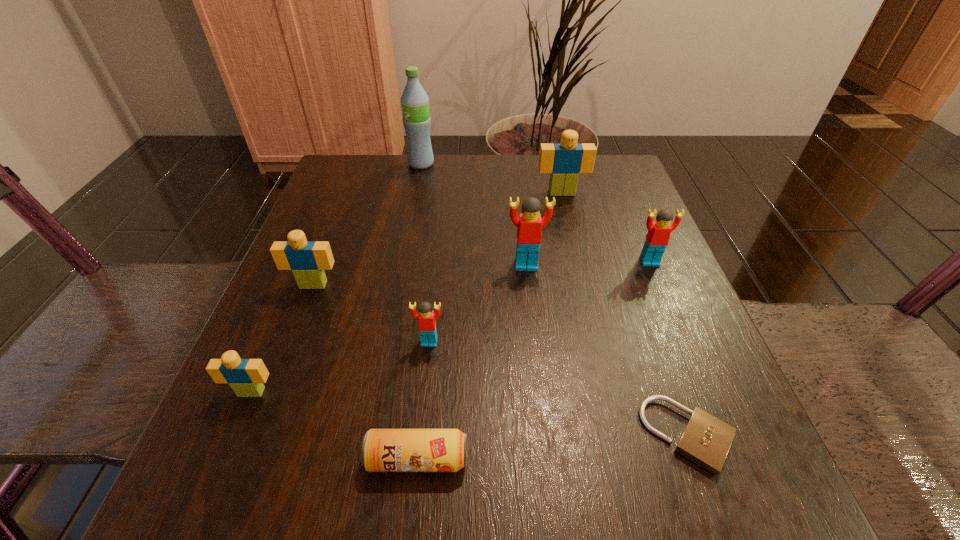
Where is `the second nearest Lego`? the second nearest Lego is located at coordinates (426, 319).

I want to click on the nearest red Lego, so click(426, 319).

Identify the location of the nearest Lego. This screenshot has height=540, width=960. (246, 377).

You are a GUI agent. You are given a task and a screenshot of the screen. Output one action in this format:
    pyautogui.click(x=<x>, y=<y>)
    Task: Click on the smallest beige Lego
    The width and height of the screenshot is (960, 540).
    Given the screenshot: What is the action you would take?
    pyautogui.click(x=246, y=377)

This screenshot has width=960, height=540. I want to click on beer can, so click(x=383, y=450).

This screenshot has height=540, width=960. In order to click on beige padlock in this screenshot , I will do `click(706, 440)`.

Locate an element on the screen. padlock is located at coordinates (706, 440).

I want to click on vacant area situated on the left of the green water bottle, so click(x=376, y=164).

Identify the location of vacant space located 0.070m on the face of the fifth Lego from left to right. This screenshot has height=540, width=960. (567, 215).

You are a GUI agent. You are given a task and a screenshot of the screen. Output one action in this format:
    pyautogui.click(x=<x>, y=<y>)
    Task: Click on the free spot located on the face of the second red Lego from right to left
    
    Given the screenshot: What is the action you would take?
    pyautogui.click(x=536, y=348)